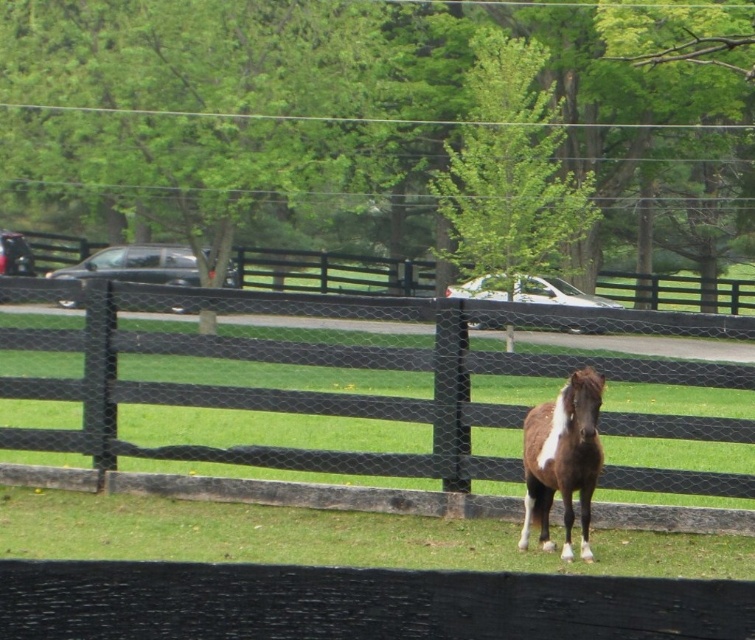
Question: Does green grass at lower center have a smaller size compared to brown glossy horse at center?

Choices:
 (A) yes
 (B) no

Answer: (B)

Question: Among these objects, which one is nearest to the camera?

Choices:
 (A) brown glossy horse at center
 (B) black wooden fence at center
 (C) green grass at lower center

Answer: (A)

Question: Does green grass at lower center appear on the left side of brown glossy horse at center?

Choices:
 (A) no
 (B) yes

Answer: (B)

Question: Does black wooden fence at center have a larger size compared to brown glossy horse at center?

Choices:
 (A) yes
 (B) no

Answer: (A)

Question: Which point is closer to the camera taking this photo?

Choices:
 (A) (515, 308)
 (B) (562, 444)

Answer: (B)

Question: Among these objects, which one is farthest from the camera?

Choices:
 (A) brown glossy horse at center
 (B) black wooden fence at center
 (C) green grass at lower center

Answer: (B)